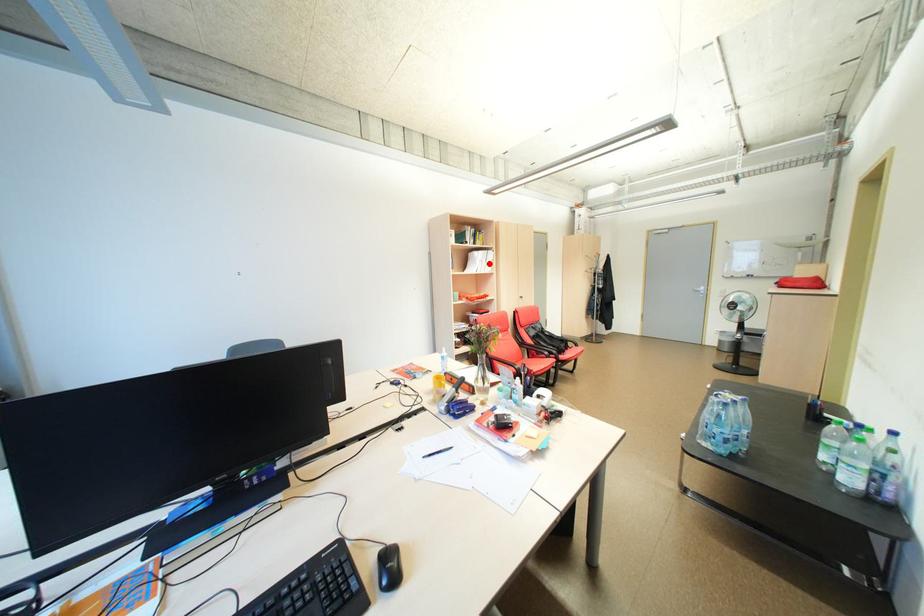
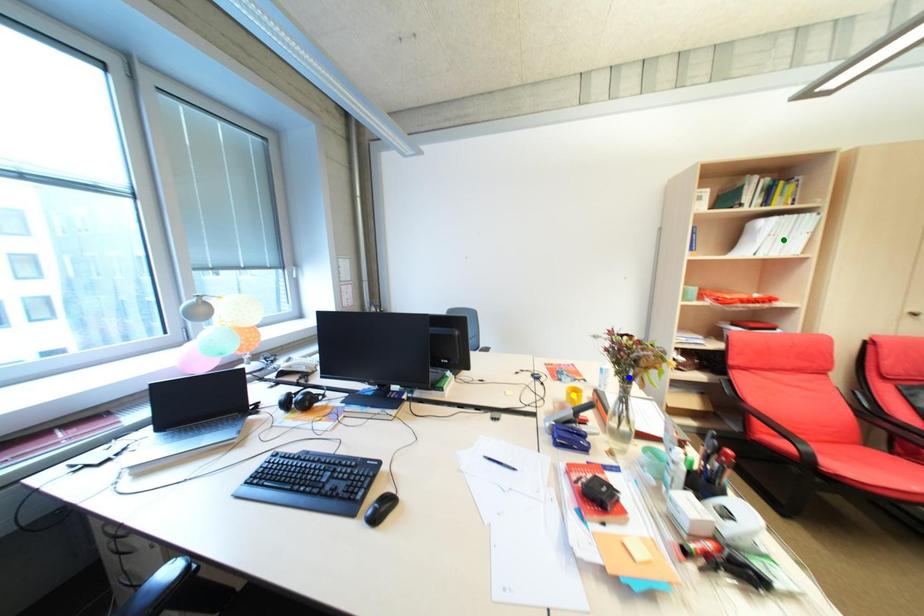
Question: I am providing you with two images of the same scene from different viewpoints. A red point is marked on the first image. You are given multiple points on the second image. In image 2, which mark is for the same physical point as the one in image 1?

Choices:
 (A) green point
 (B) yellow point
 (C) blue point

Answer: (A)